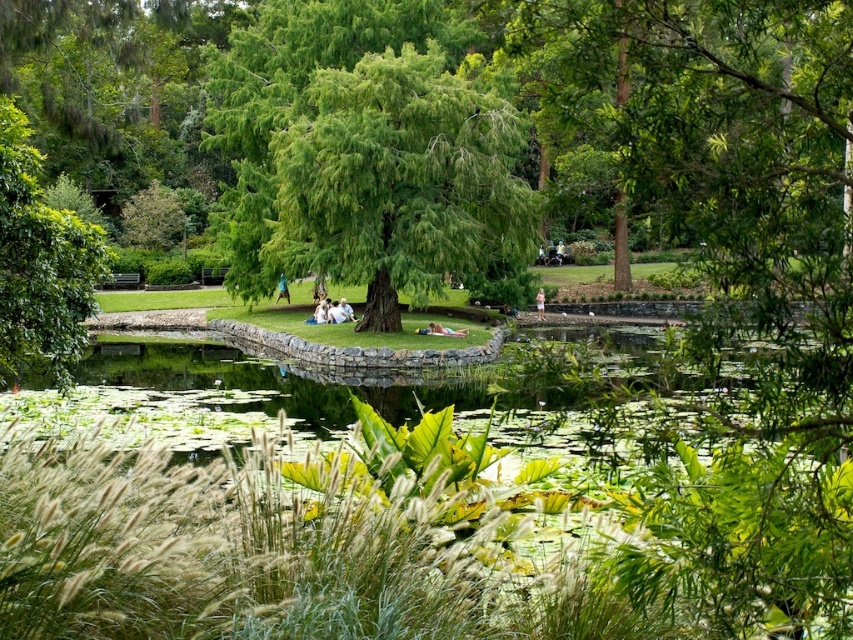
Question: Is green leafy tree at center to the right of blue fabric person at center from the viewer's perspective?

Choices:
 (A) yes
 (B) no

Answer: (A)

Question: Among these objects, which one is farthest from the camera?

Choices:
 (A) blue fabric person at center
 (B) pink fabric dress at center
 (C) green leafy tree at center
 (D) light brown wooden bench at center

Answer: (B)

Question: Based on their relative distances, which object is nearer to the green leafy tree at left?

Choices:
 (A) light brown wooden bench at center
 (B) green leafy tree at center

Answer: (B)

Question: Which of these objects is positioned closest to the green leafy tree at center?

Choices:
 (A) pink fabric dress at center
 (B) green leafy tree at left
 (C) light brown wooden bench at center
 (D) blue fabric person at center

Answer: (C)

Question: Does green leafy tree at center appear over green leafy tree at left?

Choices:
 (A) yes
 (B) no

Answer: (A)

Question: Can you confirm if blue fabric person at center is thinner than pink fabric dress at center?

Choices:
 (A) yes
 (B) no

Answer: (B)